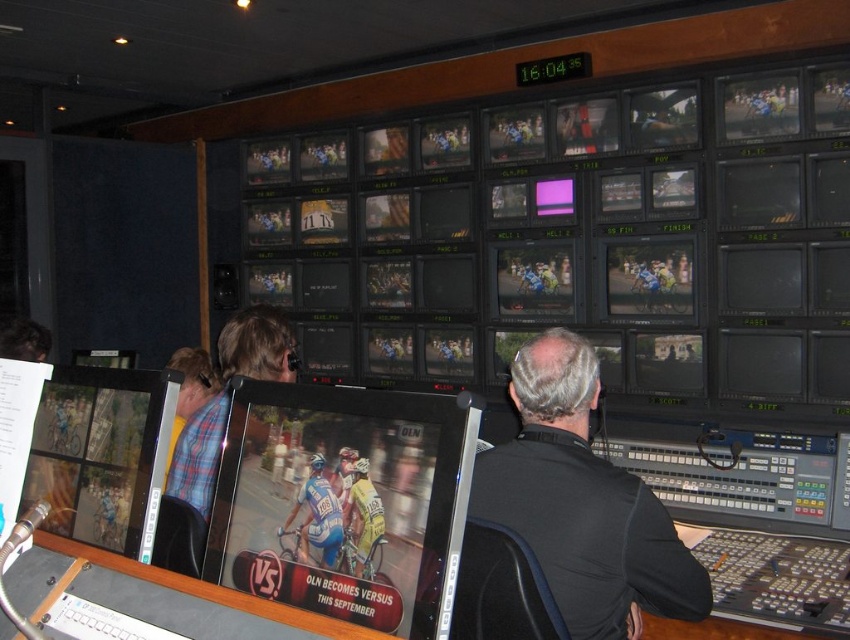
Question: Which object is the closest to the matte black bicycle race at center?

Choices:
 (A) matte plastic computer screen at center
 (B) black matte jacket at center

Answer: (B)

Question: Based on their relative distances, which object is nearer to the plaid shirt at center?

Choices:
 (A) black matte monitor at center
 (B) blue jersey at center
 (C) matte plastic computer screen at center
 (D) matte black bicycle race at center

Answer: (C)

Question: Which object is the farthest from the black matte monitor at center-right?

Choices:
 (A) shiny plastic monitor at center
 (B) plaid shirt at center
 (C) matte black bicycle race at center

Answer: (A)

Question: Can you confirm if matte black bicycle race at center is positioned to the left of black matte monitor at center?

Choices:
 (A) yes
 (B) no

Answer: (A)

Question: Is the position of shiny plastic monitor at center less distant than that of yellow jersey at center?

Choices:
 (A) no
 (B) yes

Answer: (B)

Question: Observing the image, what is the correct spatial positioning of matte black bicycle race at center in reference to blue jersey at center?

Choices:
 (A) below
 (B) above

Answer: (B)